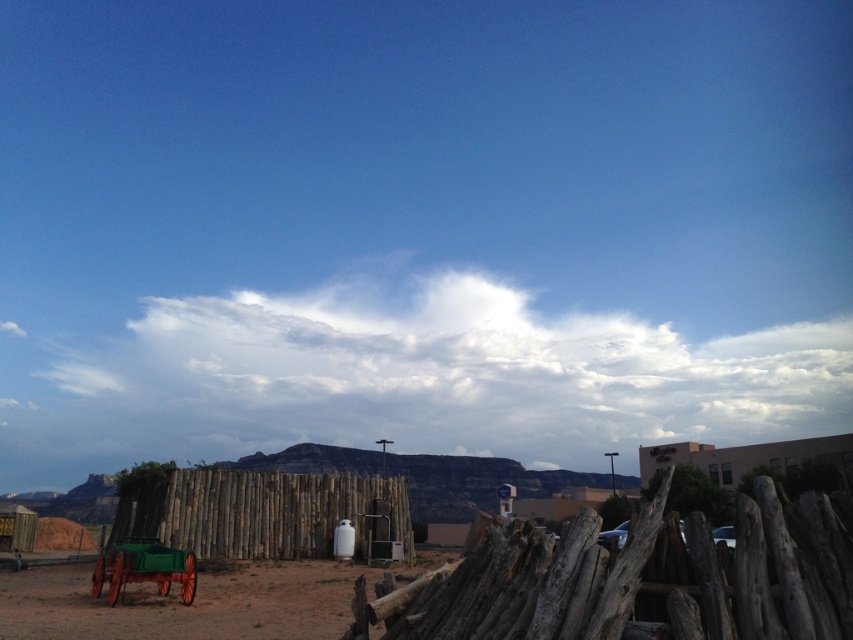
Question: Which object is positioned closest to the driftwood at center?

Choices:
 (A) brown dirt field at lower left
 (B) white fluffy cloud at upper center

Answer: (A)

Question: Is white fluffy cloud at upper center wider than brown dirt field at lower left?

Choices:
 (A) no
 (B) yes

Answer: (B)

Question: Which object is the closest to the white fluffy cloud at upper center?

Choices:
 (A) wooden fence at center
 (B) driftwood at center
 (C) brown dirt field at lower left

Answer: (A)

Question: Is driftwood at center positioned in front of wooden fence at center?

Choices:
 (A) yes
 (B) no

Answer: (A)

Question: Observing the image, what is the correct spatial positioning of brown dirt field at lower left in reference to wooden fence at center?

Choices:
 (A) above
 (B) below

Answer: (B)

Question: Which point is farther to the camera?

Choices:
 (A) (706, 624)
 (B) (670, 406)
 (C) (59, 608)

Answer: (B)